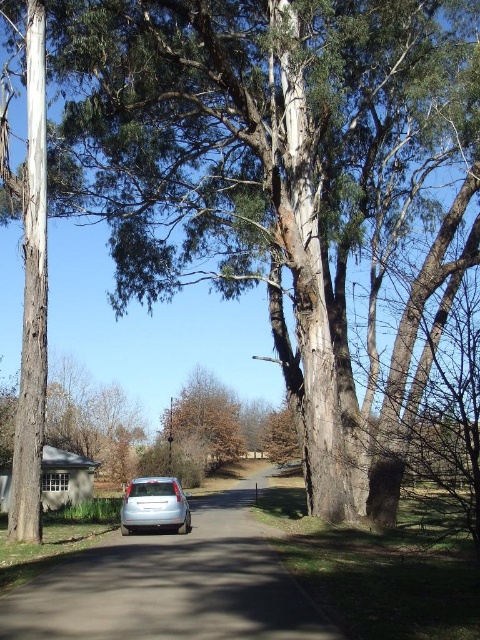
Is silver metallic car at center wider than satin silver car at center?

Indeed, silver metallic car at center has a greater width compared to satin silver car at center.

Is silver metallic car at center to the right of satin silver car at center from the viewer's perspective?

Correct, you'll find silver metallic car at center to the right of satin silver car at center.

You are a GUI agent. You are given a task and a screenshot of the screen. Output one action in this format:
    pyautogui.click(x=<x>, y=<y>)
    Task: Click on the silver metallic car at center
    
    Given the screenshot: What is the action you would take?
    pyautogui.click(x=171, y=584)

Looking at this image, is brown rough tree at center smaller than satin silver car at center?

Yes.

Identify the location of brown rough tree at center. (206, 420).

Does point (229, 412) come closer to viewer compared to point (166, 509)?

No, (229, 412) is further to viewer.

At what (x,y) coordinates should I click in order to perform the action: click on brown rough tree at center. Please return your answer as a coordinate pair (x, y). Looking at the image, I should click on (206, 420).

Does silver metallic car at center have a lesser width compared to brown rough tree at center?

In fact, silver metallic car at center might be wider than brown rough tree at center.

Is silver metallic car at center below brown rough tree at center?

Yes, silver metallic car at center is below brown rough tree at center.

Is point (296, 609) positioned in front of point (216, 397)?

Yes, it is in front of point (216, 397).

You are a GUI agent. You are given a task and a screenshot of the screen. Output one action in this format:
    pyautogui.click(x=<x>, y=<y>)
    Task: Click on the silver metallic car at center
    
    Given the screenshot: What is the action you would take?
    pyautogui.click(x=171, y=584)